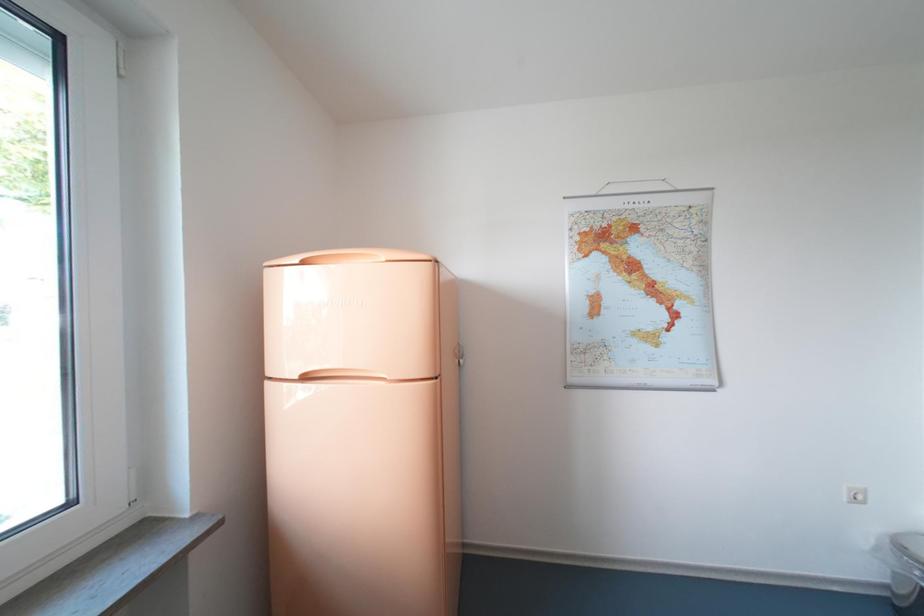
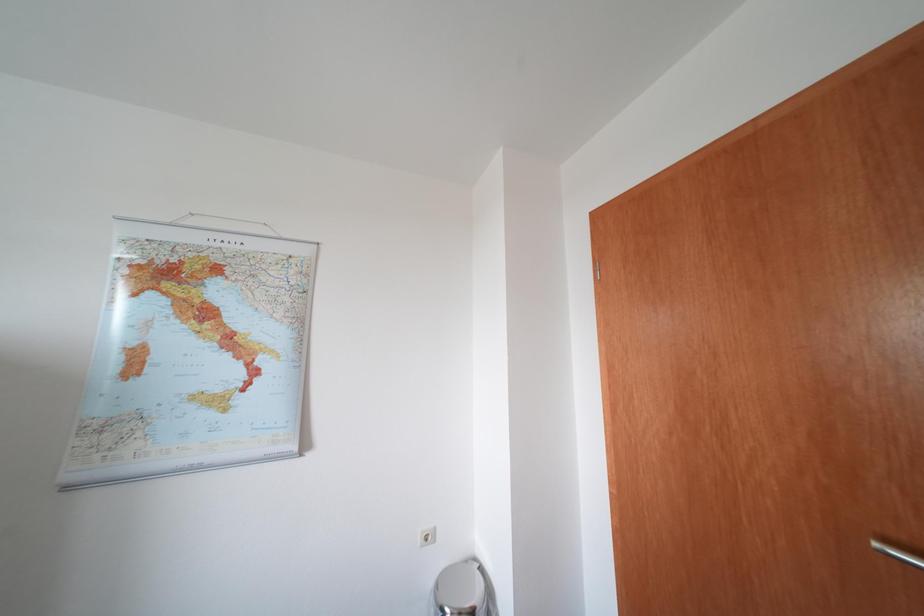
Question: Which direction would the cameraman need to move to produce the second image? Reply with the corresponding letter.

Choices:
 (A) Left
 (B) Right
 (C) Forward
 (D) Backward

Answer: (B)